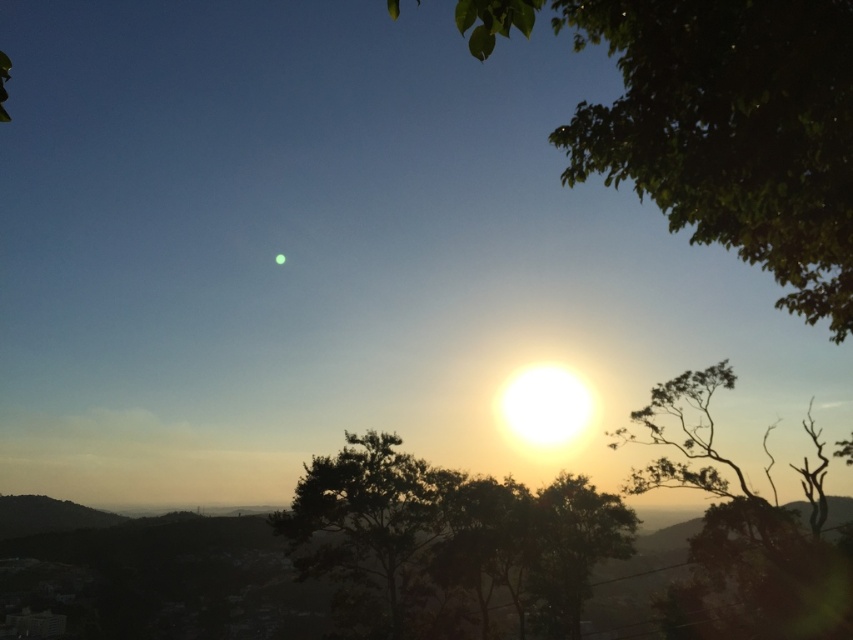
From the picture: You are an astronomer analyzing the sunset scene. You need to determine the exact location of the green leafy tree at upper right in the image. What are its coordinates?

The green leafy tree at upper right is located at coordinates point (730, 131).